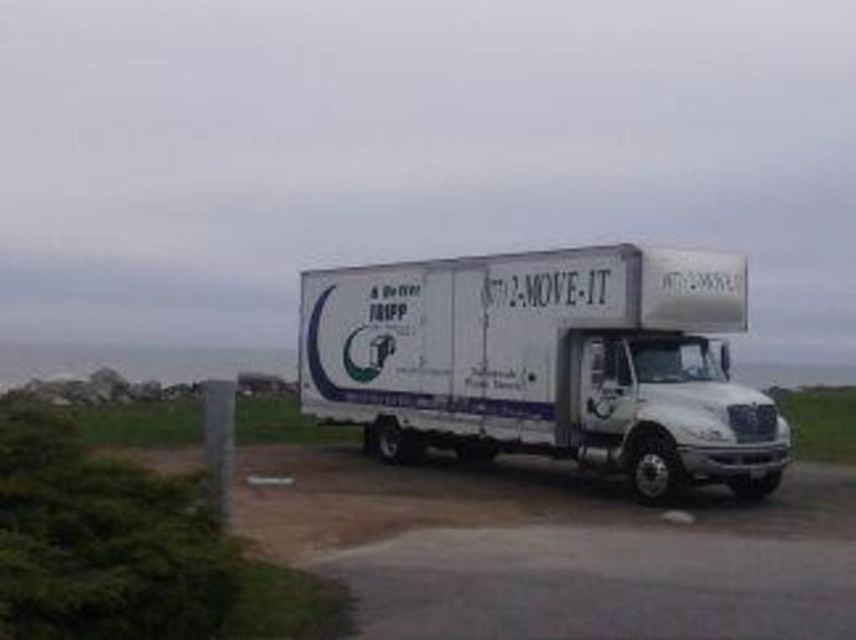
You are standing at the edge of the grassy area and want to walk towards the white matte trailer truck at center. Which direction should you move relative to the green grass at lower left?

Since the white matte trailer truck at center is further to the viewer than the green grass at lower left, you should move away from the green grass at lower left to reach the truck.

You are a delivery driver who needs to park your truck on the green grass at lower left without damaging it. The white matte trailer truck at center is currently parked there. What should you do?

The white matte trailer truck at center is positioned over the green grass at lower left, so you should move the truck to another location to avoid damaging the grass.

You are standing at the origin point of the coordinate system. You want to move towards the white matte trailer truck at center. What are the coordinates you need to move to reach it?

The white matte trailer truck at center is located at coordinates point (545, 362), so you need to move to those coordinates to reach it.